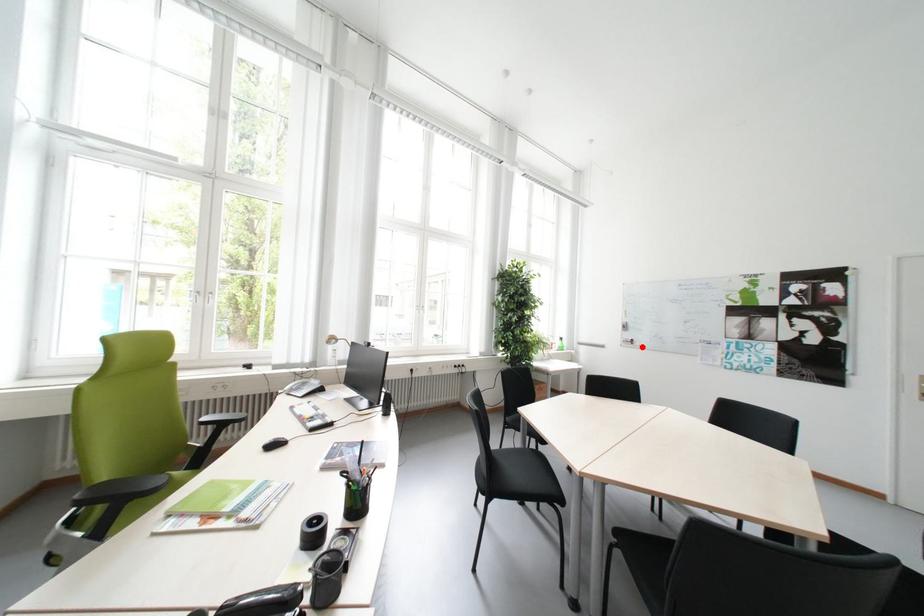
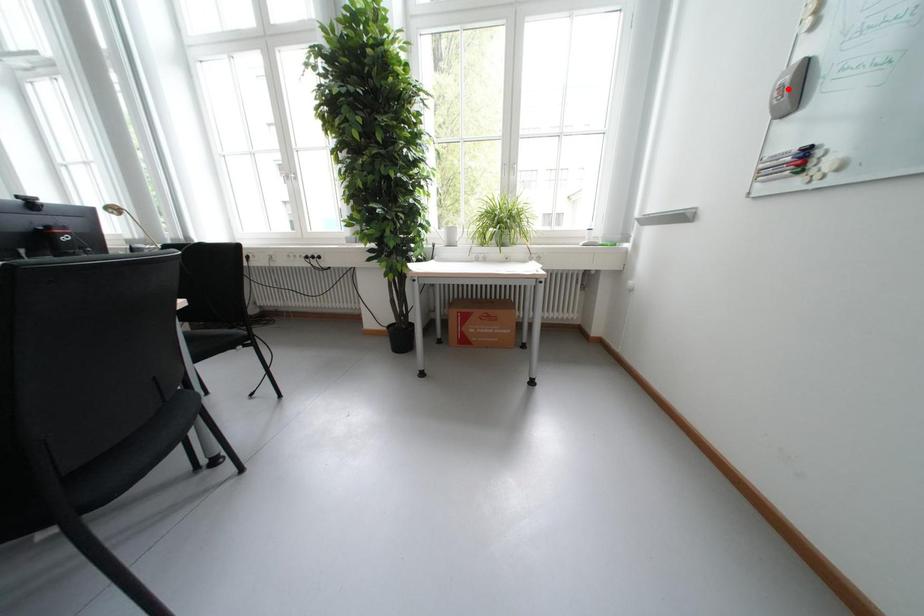
I am providing you with two images of the same scene from different viewpoints. A red point is marked on the first image and another point is marked on the second image. Is the red point in image1 aligned with the point shown in image2?

No